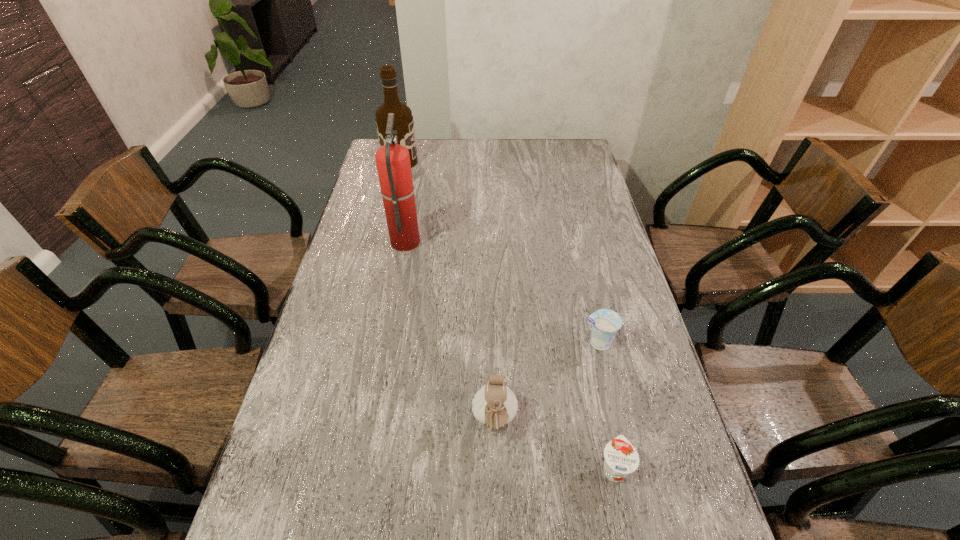
Find the location of a particular element. object that ranks as the closest to the fourth farthest object is located at coordinates (621, 458).

In order to click on vacant region that satisfies the following two spatial constraints: 1. with the nozzle and gauge on the fire extinguisher; 2. on the left side of the shortest object in this screenshot , I will do `click(364, 469)`.

The height and width of the screenshot is (540, 960). What are the coordinates of `free point that satisfies the following two spatial constraints: 1. on the label of the alcohol; 2. on the right side of the farther yogurt` in the screenshot? It's located at (356, 343).

At what (x,y) coordinates should I click in order to perform the action: click on vacant space that satisfies the following two spatial constraints: 1. with the nozzle and gauge on the fire extinguisher; 2. on the left side of the nearest object. Please return your answer as a coordinate pair (x, y). Looking at the image, I should click on (364, 469).

Find the location of a particular element. Image resolution: width=960 pixels, height=540 pixels. free space that satisfies the following two spatial constraints: 1. on the front-facing side of the pouch; 2. on the right side of the nearer yogurt is located at coordinates (495, 469).

You are a GUI agent. You are given a task and a screenshot of the screen. Output one action in this format:
    pyautogui.click(x=<x>, y=<y>)
    Task: Click on the vacant point that satisfies the following two spatial constraints: 1. on the front-facing side of the third object from right to left; 2. on the right side of the nearest object
    
    Given the screenshot: What is the action you would take?
    pyautogui.click(x=495, y=469)

Locate an element on the screen. The image size is (960, 540). vacant space that satisfies the following two spatial constraints: 1. on the back side of the shorter yogurt; 2. with the nozzle and gauge on the second farthest object is located at coordinates (565, 241).

This screenshot has width=960, height=540. Identify the location of free spot that satisfies the following two spatial constraints: 1. on the front-facing side of the shorter yogurt; 2. on the left side of the third object from right to left. (495, 469).